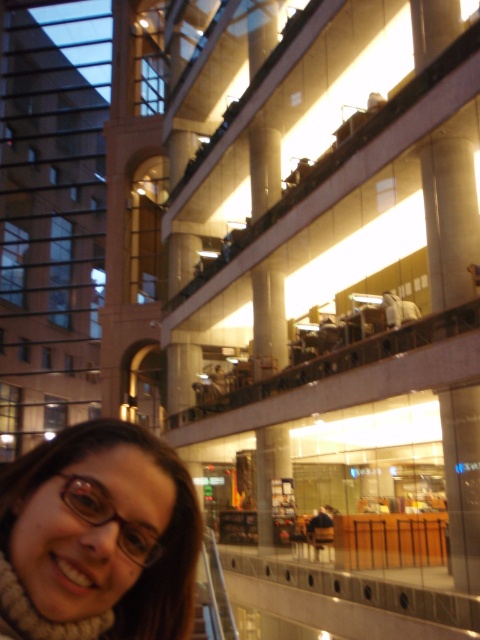
You are standing at the entrance of the mall and want to find the beige knitted scarf at lower left. Based on its 2D coordinates, which direction should you look to locate it?

The beige knitted scarf at lower left is located at coordinates point [98,538], which is towards the lower left direction from your current position at the entrance.

You are a fashion designer observing the beige knitted scarf at lower left and the translucent plastic glasses at lower left in the image. Which item is wider?

The beige knitted scarf at lower left is wider than the translucent plastic glasses at lower left.

You are a photographer taking a picture of the beige knitted scarf at lower left and the translucent plastic glasses at lower left. Which object will appear larger in the photo?

The beige knitted scarf at lower left will appear larger in the photo because it is closer to the camera than the translucent plastic glasses at lower left.